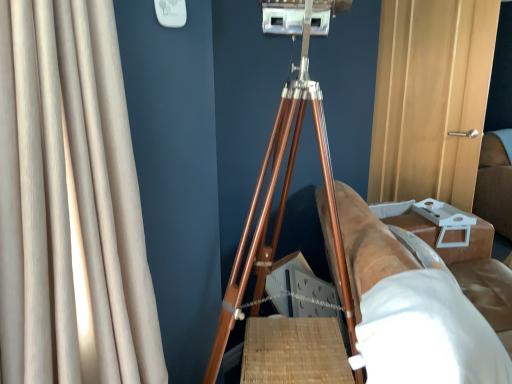
Question: Does wooden tripod at center have a smaller size compared to beige fabric curtain at left?

Choices:
 (A) no
 (B) yes

Answer: (A)

Question: Does wooden tripod at center lie in front of beige fabric curtain at left?

Choices:
 (A) yes
 (B) no

Answer: (B)

Question: Is wooden tripod at center at the right side of beige fabric curtain at left?

Choices:
 (A) yes
 (B) no

Answer: (A)

Question: Is wooden tripod at center oriented towards beige fabric curtain at left?

Choices:
 (A) yes
 (B) no

Answer: (B)

Question: Is wooden tripod at center at the left side of beige fabric curtain at left?

Choices:
 (A) yes
 (B) no

Answer: (B)

Question: In terms of width, does wooden tripod at center look wider or thinner when compared to brown leather couch at right?

Choices:
 (A) thin
 (B) wide

Answer: (A)

Question: Relative to brown leather couch at right, is wooden tripod at center in front or behind?

Choices:
 (A) front
 (B) behind

Answer: (B)

Question: Is wooden tripod at center situated inside brown leather couch at right or outside?

Choices:
 (A) inside
 (B) outside

Answer: (B)

Question: In terms of height, does wooden tripod at center look taller or shorter compared to brown leather couch at right?

Choices:
 (A) tall
 (B) short

Answer: (A)

Question: Do you think beige fabric curtain at left is within wooden tripod at center, or outside of it?

Choices:
 (A) outside
 (B) inside

Answer: (A)

Question: In terms of width, does beige fabric curtain at left look wider or thinner when compared to wooden tripod at center?

Choices:
 (A) thin
 (B) wide

Answer: (A)

Question: In the image, is beige fabric curtain at left positioned in front of or behind wooden tripod at center?

Choices:
 (A) behind
 (B) front

Answer: (B)

Question: Is beige fabric curtain at left taller or shorter than wooden tripod at center?

Choices:
 (A) tall
 (B) short

Answer: (B)

Question: Looking at their shapes, would you say brown leather couch at right is wider or thinner than beige fabric curtain at left?

Choices:
 (A) wide
 (B) thin

Answer: (A)

Question: From a real-world perspective, is brown leather couch at right above or below beige fabric curtain at left?

Choices:
 (A) above
 (B) below

Answer: (B)